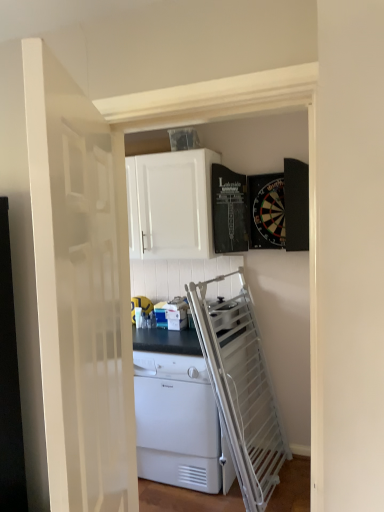
Question: Can we say white glossy door at center lies outside white plastic dishwasher at center?

Choices:
 (A) no
 (B) yes

Answer: (B)

Question: Is white glossy door at center wider than white plastic dishwasher at center?

Choices:
 (A) no
 (B) yes

Answer: (A)

Question: Does white glossy door at center have a larger size compared to white plastic dishwasher at center?

Choices:
 (A) no
 (B) yes

Answer: (A)

Question: Would you say white glossy door at center is a long distance from white plastic dishwasher at center?

Choices:
 (A) yes
 (B) no

Answer: (A)

Question: From a real-world perspective, is white glossy door at center located beneath white plastic dishwasher at center?

Choices:
 (A) yes
 (B) no

Answer: (B)

Question: Looking at their shapes, would you say yellow rubber ball at center is wider or thinner than white glossy door at center?

Choices:
 (A) wide
 (B) thin

Answer: (A)

Question: Based on their positions, is yellow rubber ball at center located to the left or right of white glossy door at center?

Choices:
 (A) left
 (B) right

Answer: (A)

Question: Based on their sizes in the image, would you say yellow rubber ball at center is bigger or smaller than white glossy door at center?

Choices:
 (A) small
 (B) big

Answer: (A)

Question: From the image's perspective, is yellow rubber ball at center located above or below white glossy door at center?

Choices:
 (A) below
 (B) above

Answer: (A)

Question: Is white matte cabinet at upper center in front of or behind white glossy door at center in the image?

Choices:
 (A) behind
 (B) front

Answer: (A)

Question: Considering the positions of white matte cabinet at upper center and white glossy door at center in the image, is white matte cabinet at upper center taller or shorter than white glossy door at center?

Choices:
 (A) tall
 (B) short

Answer: (B)

Question: In the image, is white matte cabinet at upper center on the left side or the right side of white glossy door at center?

Choices:
 (A) right
 (B) left

Answer: (A)

Question: From the image's perspective, is white matte cabinet at upper center located above or below white glossy door at center?

Choices:
 (A) above
 (B) below

Answer: (A)

Question: Relative to yellow rubber ball at center, is white matte cabinet at upper center in front or behind?

Choices:
 (A) front
 (B) behind

Answer: (A)

Question: From a real-world perspective, is white matte cabinet at upper center positioned above or below yellow rubber ball at center?

Choices:
 (A) below
 (B) above

Answer: (B)